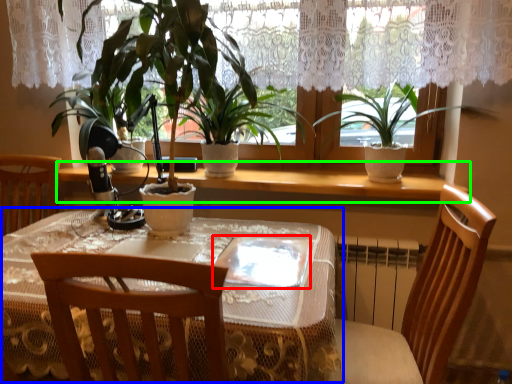
Question: Which object is positioned closest to glass plate (highlighted by a red box)? Select from table (highlighted by a blue box) and window sill (highlighted by a green box).

Choices:
 (A) table
 (B) window sill

Answer: (A)